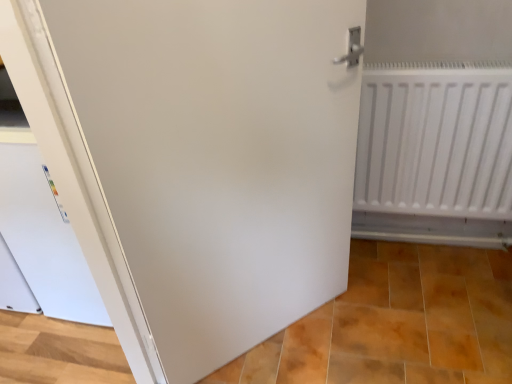
Question: In the image, is white matte radiator at right positioned in front of or behind matte white tile at lower center?

Choices:
 (A) front
 (B) behind

Answer: (B)

Question: Considering the positions of white matte radiator at right and matte white tile at lower center in the image, is white matte radiator at right wider or thinner than matte white tile at lower center?

Choices:
 (A) thin
 (B) wide

Answer: (A)

Question: Which object is positioned closest to the white matte radiator at right?

Choices:
 (A) matte white tile at lower center
 (B) white matte door at center

Answer: (B)

Question: Considering the real-world distances, which object is closest to the white matte door at center?

Choices:
 (A) matte white tile at lower center
 (B) white matte radiator at right

Answer: (B)